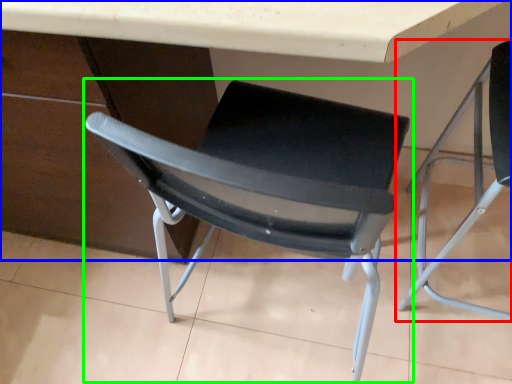
Question: Which object is positioned closest to chair (highlighted by a red box)? Select from table (highlighted by a blue box) and chair (highlighted by a green box).

Choices:
 (A) table
 (B) chair

Answer: (A)